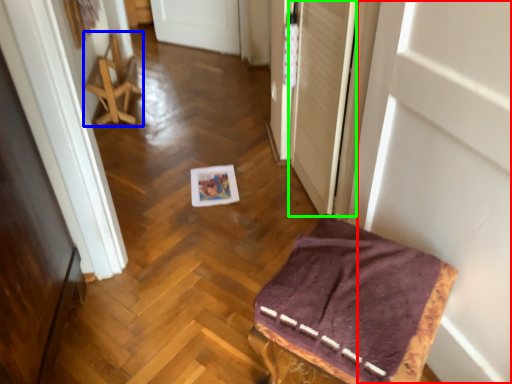
Question: Which is nearer to the door (highlighted by a red box)? furniture (highlighted by a blue box) or screen door (highlighted by a green box).

Choices:
 (A) furniture
 (B) screen door

Answer: (B)